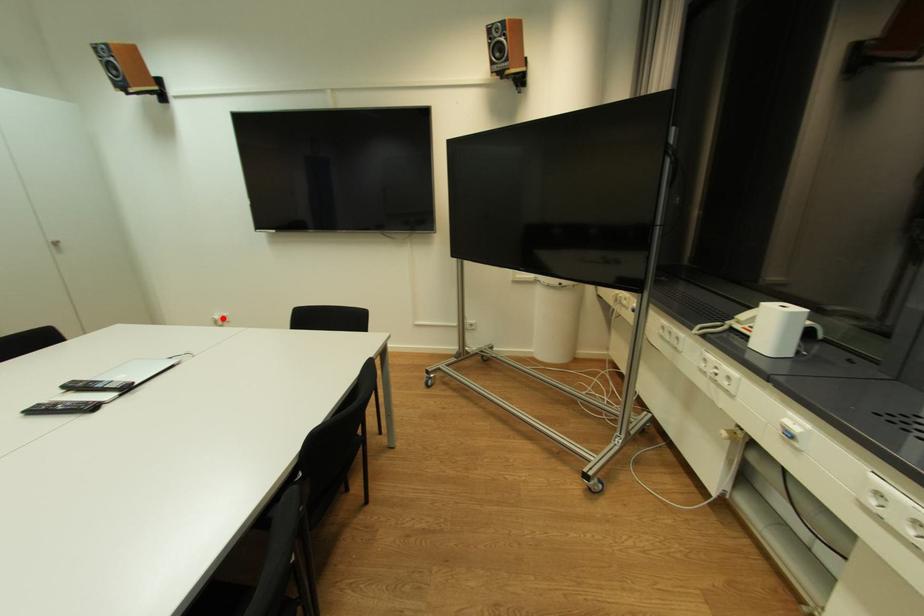
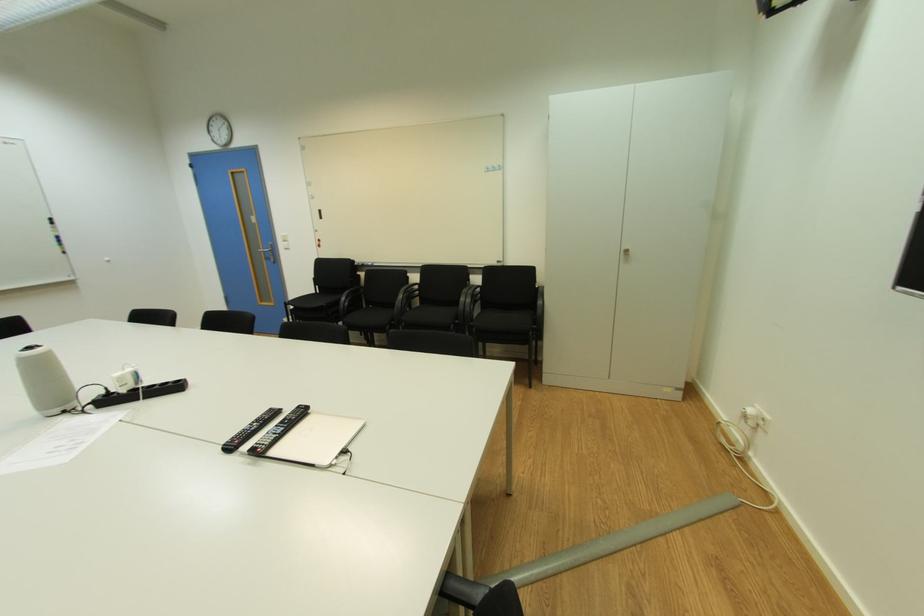
Question: I am providing you with two images of the same scene from different viewpoints. A red point is shown in image1. For the corresponding object point in image2, is it positioned nearer or farther from the camera?

Choices:
 (A) Nearer
 (B) Farther

Answer: (A)